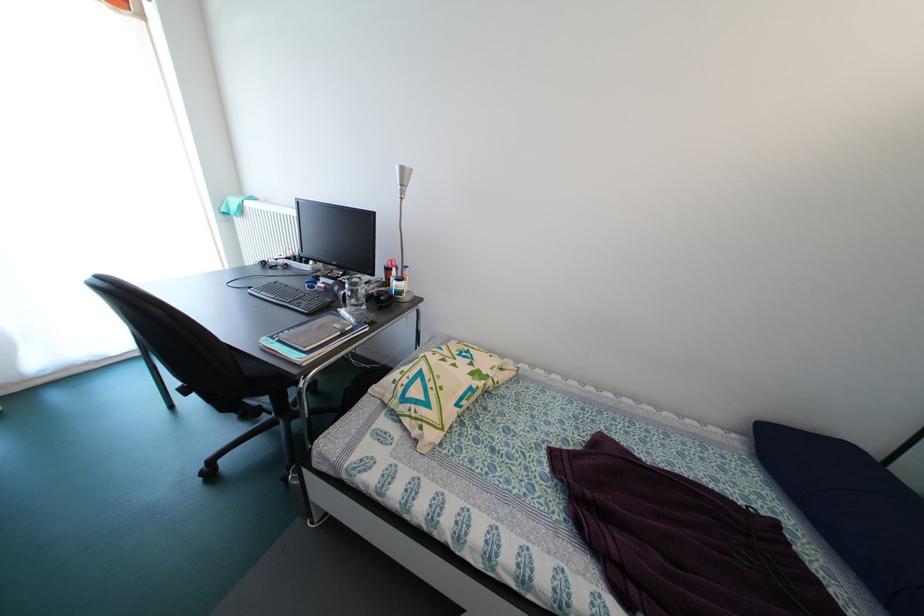
Where is `patterned pillow`? patterned pillow is located at coordinates (440, 387).